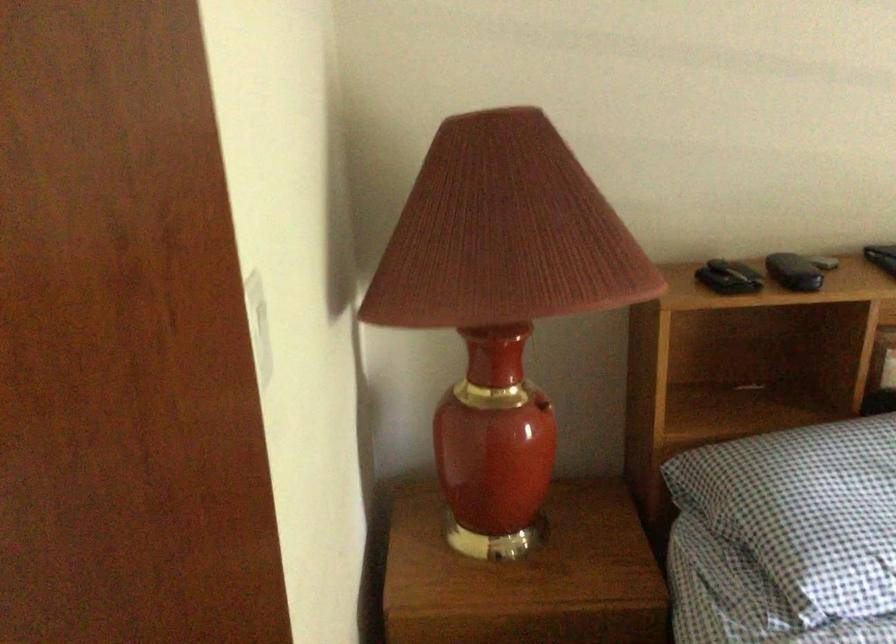
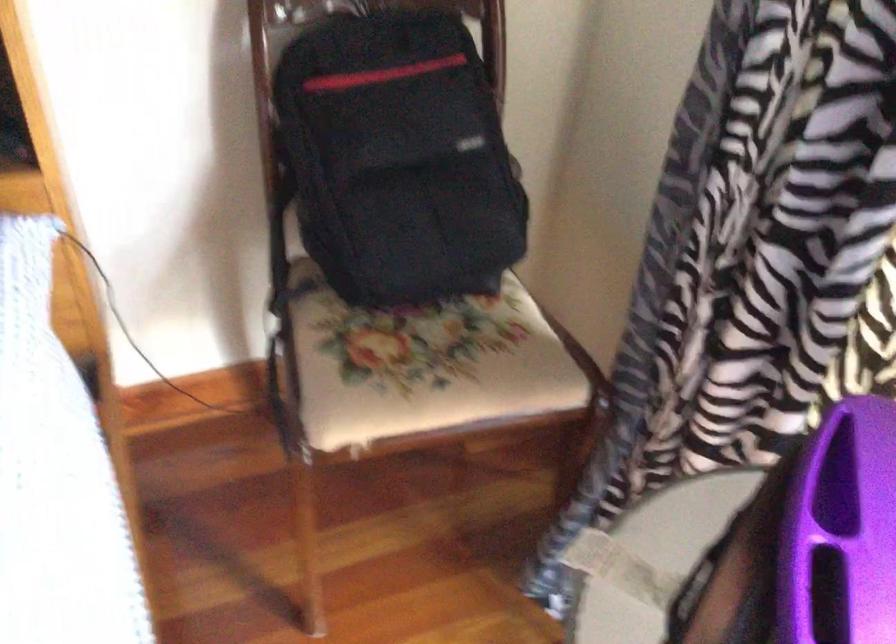
Question: The images are taken continuously from a first-person perspective. In which direction are you moving?

Choices:
 (A) Left
 (B) Right
 (C) Forward
 (D) Backward

Answer: (B)